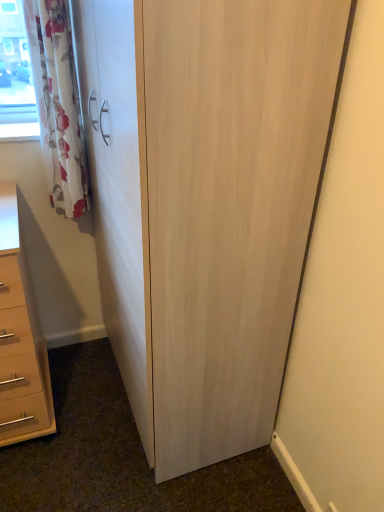
Question: In the image, is light wood cupboard at center positioned in front of or behind matte beige chest of drawers at lower left?

Choices:
 (A) behind
 (B) front

Answer: (B)

Question: From a real-world perspective, is light wood cupboard at center physically located above or below matte beige chest of drawers at lower left?

Choices:
 (A) below
 (B) above

Answer: (B)

Question: Based on their relative distances, which object is farther from the matte beige chest of drawers at lower left?

Choices:
 (A) light wood cupboard at center
 (B) white floral fabric curtain at upper left

Answer: (A)

Question: Which is farther from the light wood cupboard at center?

Choices:
 (A) matte beige chest of drawers at lower left
 (B) white floral fabric curtain at upper left

Answer: (A)